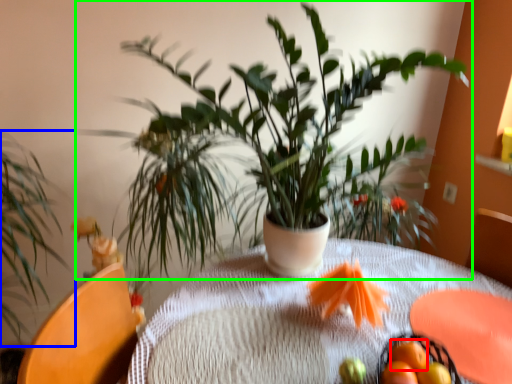
Question: Based on their relative distances, which object is farther from tangerine (highlighted by a red box)? Choose from houseplant (highlighted by a blue box) and houseplant (highlighted by a green box).

Choices:
 (A) houseplant
 (B) houseplant

Answer: (A)